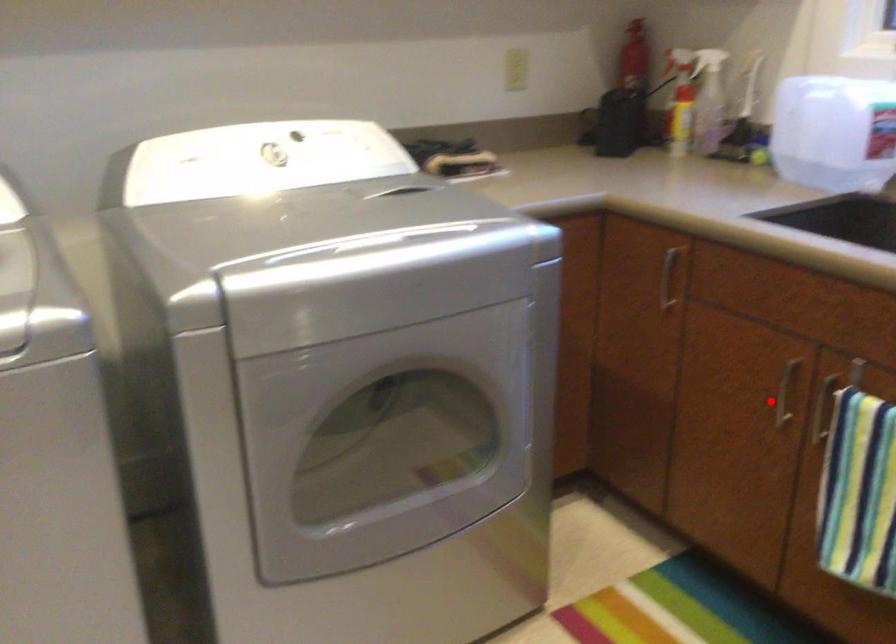
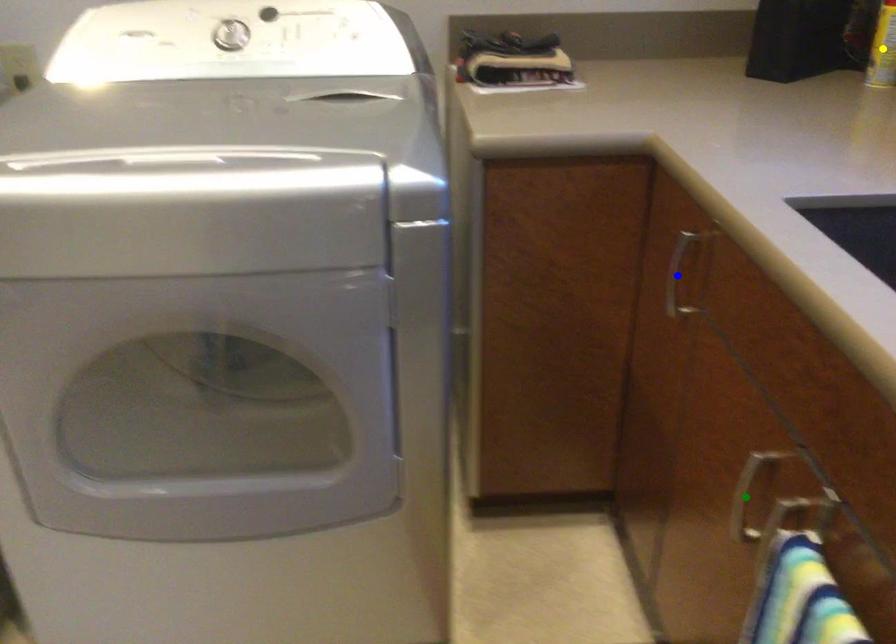
Question: I am providing you with two images of the same scene from different viewpoints. A red point is marked on the first image. You are given multiple points on the second image. Can you choose the point in image 2 that corresponds to the point in image 1?

Choices:
 (A) yellow point
 (B) blue point
 (C) green point

Answer: (C)